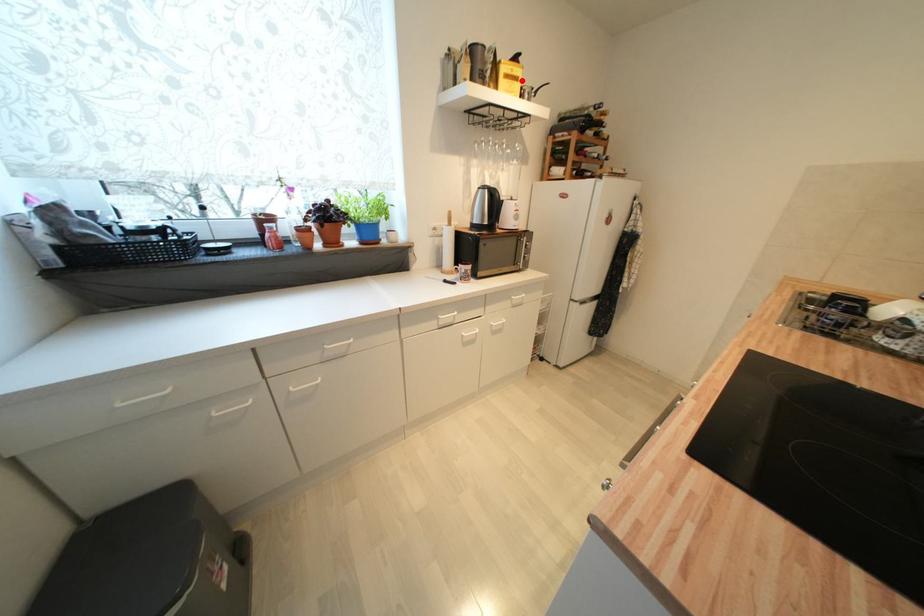
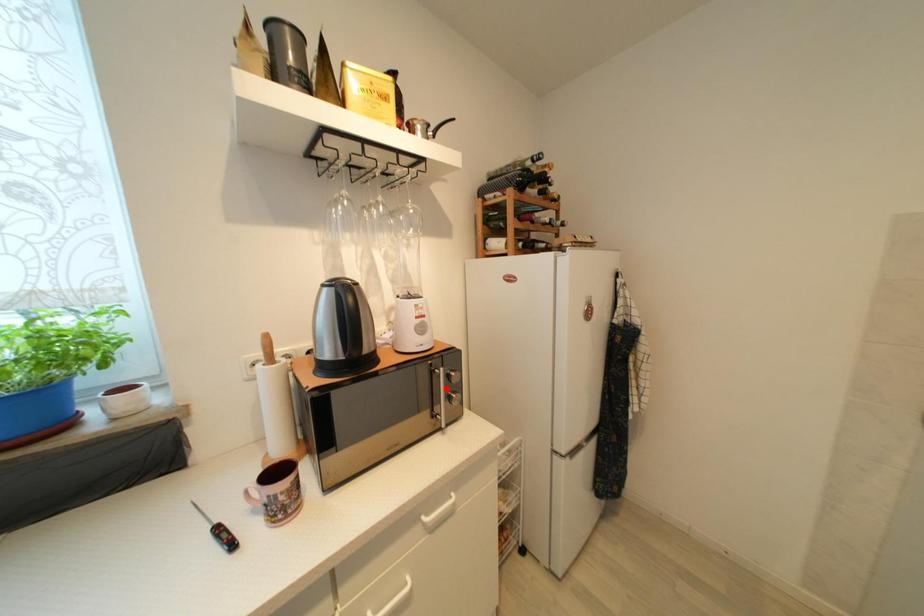
I am providing you with two images of the same scene from different viewpoints. A red point is marked on the first image and another point is marked on the second image. Is the marked point in image1 the same physical position as the marked point in image2?

No